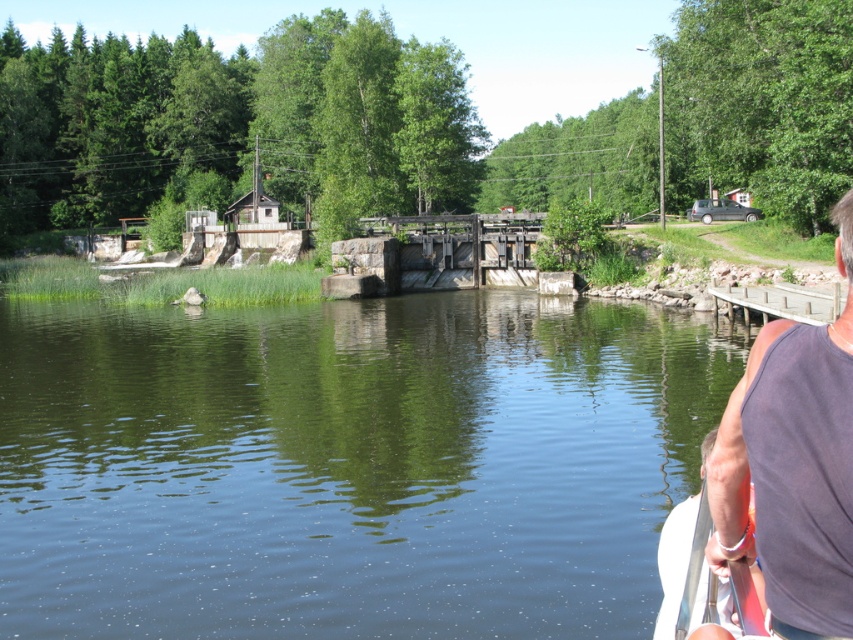
Question: Is the position of dark gray tank top at right less distant than that of white plastic paddle at right?

Choices:
 (A) no
 (B) yes

Answer: (B)

Question: Among these points, which one is nearest to the camera?

Choices:
 (A) (550, 426)
 (B) (708, 522)

Answer: (B)

Question: Is white plastic paddle at right below white plastic paddle at lower right?

Choices:
 (A) no
 (B) yes

Answer: (B)

Question: Among these points, which one is farthest from the camera?

Choices:
 (A) (700, 531)
 (B) (846, 429)
 (C) (666, 604)
 (D) (56, 348)

Answer: (D)

Question: Can you confirm if dark gray tank top at right is positioned to the left of white plastic paddle at lower right?

Choices:
 (A) no
 (B) yes

Answer: (B)

Question: Which of the following is the farthest from the observer?

Choices:
 (A) green smooth water at center
 (B) white plastic paddle at lower right
 (C) dark gray tank top at right

Answer: (A)